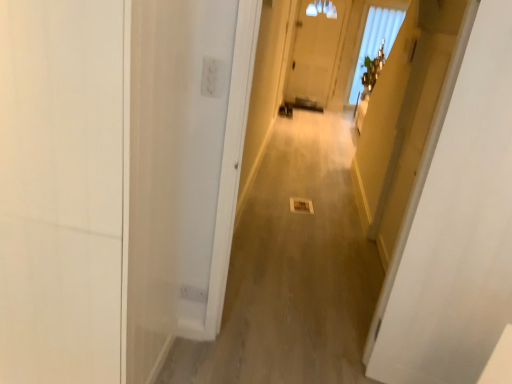
Question: From a real-world perspective, is white glossy door at upper right, arranged as the first door when viewed from the right, above or below translucent glass window at upper center?

Choices:
 (A) below
 (B) above

Answer: (A)

Question: From the image's perspective, is white glossy door at upper right, arranged as the first door when viewed from the right, positioned above or below translucent glass window at upper center?

Choices:
 (A) above
 (B) below

Answer: (B)

Question: Considering the real-world distances, which object is farthest from the white matte door at left, positioned as the second door in right-to-left order?

Choices:
 (A) white glossy door at upper right, acting as the second door starting from the left
 (B) smooth beige carpet at center
 (C) translucent glass window at upper center

Answer: (C)

Question: Based on their relative distances, which object is farther from the smooth beige carpet at center?

Choices:
 (A) translucent glass window at upper center
 (B) white glossy door at upper right, arranged as the first door when viewed from the right
 (C) white matte door at left, the 1th door viewed from the left

Answer: (A)